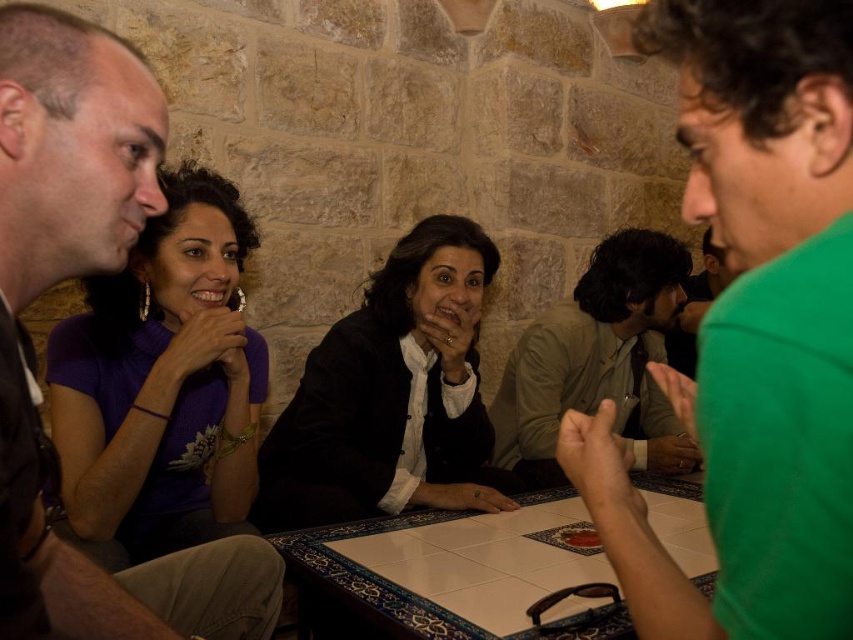
You are taking a photo of the scene and want to focus on both point (469, 244) and point (631, 426). Since the camera can only focus on one depth at a time, which point should you focus on to ensure the closer one is sharp?

You should focus on point (469, 244) because it is closer to the camera than point (631, 426), ensuring it remains sharp.

You are organizing a photo shoot and need to ensure that all participants are visible in the frame. Given that the green matte shirt at center and the khaki cotton shirt at center are both in the center of the image, which one might be more likely to fit within a smaller camera frame?

The green matte shirt at center occupies less space than the khaki cotton shirt at center, so it would fit better in a smaller camera frame.

Based on the photo, you are a photographer trying to capture a candid shot of the group. You notice the matte black jacket at center and the khaki cotton shirt at center. Which clothing item will appear larger in your photo due to its position?

The matte black jacket at center will appear larger in the photo because it is closer to the viewer than the khaki cotton shirt at center.